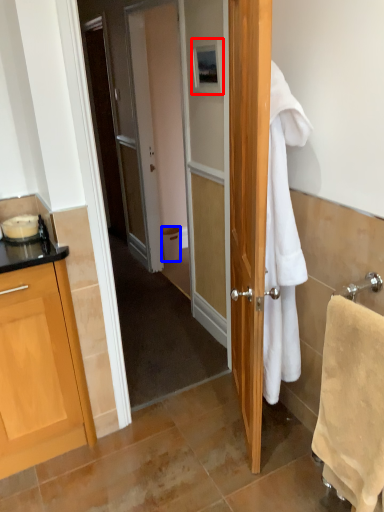
Question: Which object is further to the camera taking this photo, picture frame (highlighted by a red box) or trash bin/can (highlighted by a blue box)?

Choices:
 (A) picture frame
 (B) trash bin/can

Answer: (B)